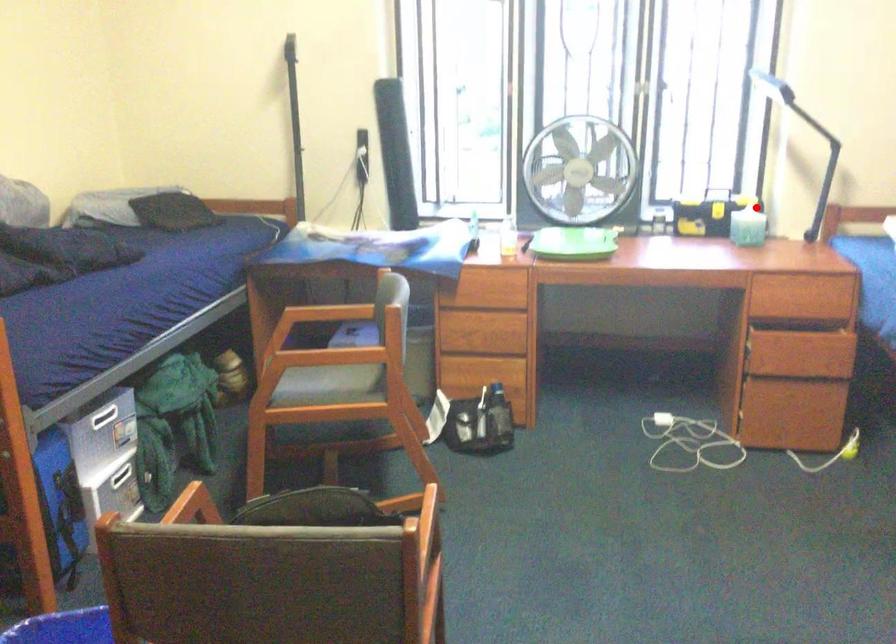
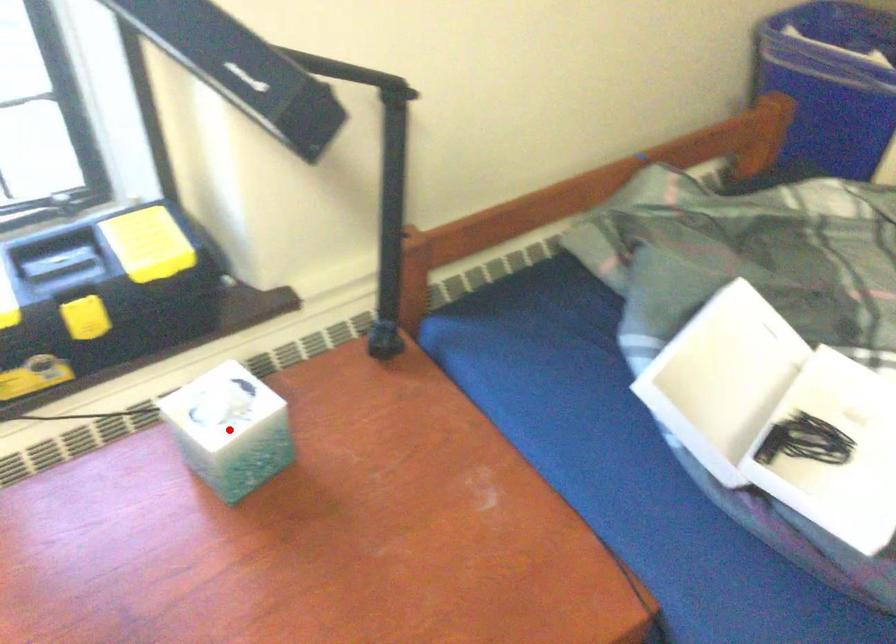
I am providing you with two images of the same scene from different viewpoints. A red point is marked on the first image and another point is marked on the second image. Are the points marked in image1 and image2 representing the same 3D position?

Yes